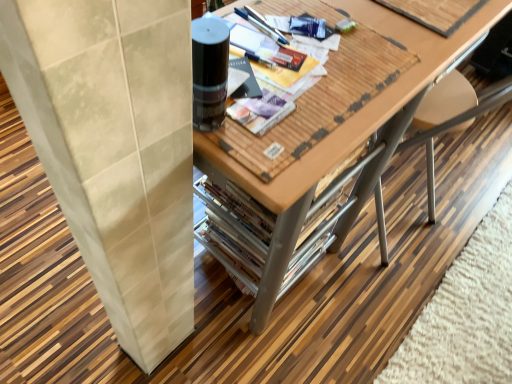
Question: Is matte black magazine at center, arranged as the second magazine when viewed from the top, placed right next to wooden table at center?

Choices:
 (A) yes
 (B) no

Answer: (B)

Question: Is matte black magazine at center, arranged as the second magazine when viewed from the top, thinner than wooden table at center?

Choices:
 (A) no
 (B) yes

Answer: (B)

Question: Can you confirm if matte black magazine at center, marked as the first magazine in a bottom-to-top arrangement, is shorter than wooden table at center?

Choices:
 (A) no
 (B) yes

Answer: (B)

Question: Does matte black magazine at center, the 2th magazine positioned from the right, appear on the left side of wooden table at center?

Choices:
 (A) no
 (B) yes

Answer: (B)

Question: Does matte black magazine at center, which ranks as the 1th magazine in left-to-right order, turn towards wooden table at center?

Choices:
 (A) no
 (B) yes

Answer: (A)

Question: From the image's perspective, is matte black magazine at center, which ranks as the 1th magazine in left-to-right order, above or below wooden magazine at upper right, which appears as the 1th magazine when viewed from the back?

Choices:
 (A) above
 (B) below

Answer: (B)

Question: Considering the relative positions of matte black magazine at center, marked as the first magazine in a bottom-to-top arrangement, and wooden magazine at upper right, the 2th magazine from the bottom, in the image provided, is matte black magazine at center, marked as the first magazine in a bottom-to-top arrangement, to the left or to the right of wooden magazine at upper right, the 2th magazine from the bottom,?

Choices:
 (A) left
 (B) right

Answer: (A)

Question: Looking at their shapes, would you say matte black magazine at center, which ranks as the 2th magazine in back-to-front order, is wider or thinner than wooden magazine at upper right, which is counted as the first magazine, starting from the right?

Choices:
 (A) wide
 (B) thin

Answer: (B)

Question: In the image, is matte black magazine at center, which ranks as the 2th magazine in back-to-front order, positioned in front of or behind wooden magazine at upper right, placed as the 1th magazine when sorted from top to bottom?

Choices:
 (A) behind
 (B) front

Answer: (B)

Question: Is wooden table at center to the left or to the right of matte black magazine at center, arranged as the second magazine when viewed from the top, in the image?

Choices:
 (A) right
 (B) left

Answer: (A)

Question: From the image's perspective, is wooden table at center located above or below matte black magazine at center, arranged as the second magazine when viewed from the top?

Choices:
 (A) above
 (B) below

Answer: (B)

Question: Relative to matte black magazine at center, the first magazine from the front, is wooden table at center in front or behind?

Choices:
 (A) front
 (B) behind

Answer: (A)

Question: Is point (362, 201) closer or farther from the camera than point (269, 39)?

Choices:
 (A) farther
 (B) closer

Answer: (A)

Question: Is wooden magazine at upper right, the 2th magazine from the bottom, to the left or to the right of matte black magazine at center, the first magazine from the front, in the image?

Choices:
 (A) right
 (B) left

Answer: (A)

Question: Does point [x=412, y=1] appear closer or farther from the camera than point [x=267, y=61]?

Choices:
 (A) closer
 (B) farther

Answer: (B)